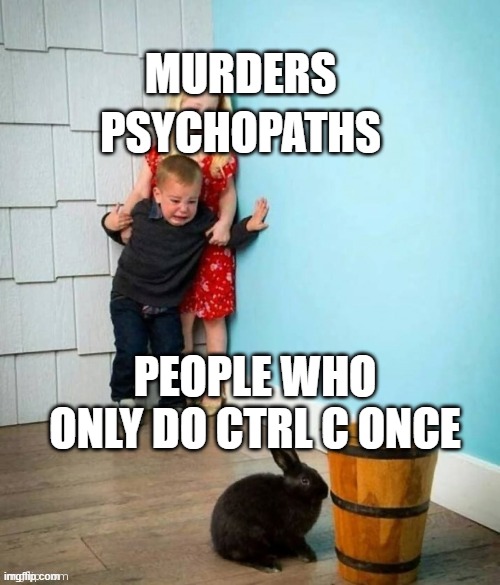
Where is `tiled white wall`? This screenshot has width=500, height=585. tiled white wall is located at coordinates (47, 324).